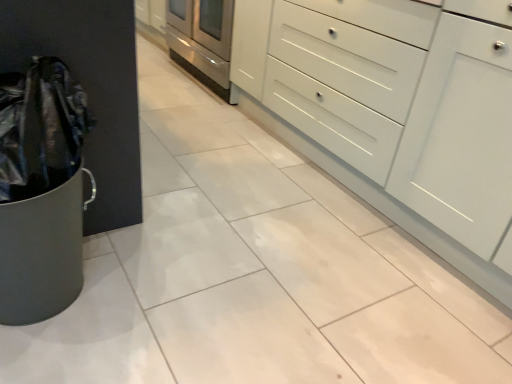
Question: Considering their positions, is stainless steel oven at center located in front of or behind white glossy cabinet at center?

Choices:
 (A) front
 (B) behind

Answer: (B)

Question: Is stainless steel oven at center situated inside white glossy cabinet at center or outside?

Choices:
 (A) inside
 (B) outside

Answer: (B)

Question: Is stainless steel oven at center to the left or to the right of white glossy cabinet at center in the image?

Choices:
 (A) left
 (B) right

Answer: (A)

Question: Looking at the image, does white glossy cabinet at center seem bigger or smaller compared to stainless steel oven at center?

Choices:
 (A) small
 (B) big

Answer: (B)

Question: From a real-world perspective, relative to stainless steel oven at center, is white glossy cabinet at center vertically above or below?

Choices:
 (A) below
 (B) above

Answer: (B)

Question: In the image, is white glossy cabinet at center positioned in front of or behind stainless steel oven at center?

Choices:
 (A) front
 (B) behind

Answer: (A)

Question: Is point (322, 114) positioned closer to the camera than point (180, 57)?

Choices:
 (A) closer
 (B) farther

Answer: (A)